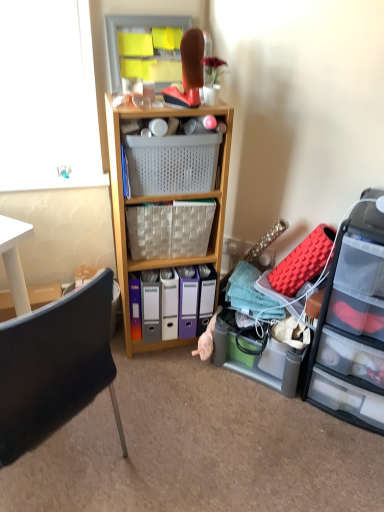
You are a GUI agent. You are given a task and a screenshot of the screen. Output one action in this format:
    pyautogui.click(x=<x>, y=<y>)
    Task: Click on the free space to the left of clear plastic drawers at right
    
    Given the screenshot: What is the action you would take?
    pyautogui.click(x=264, y=417)